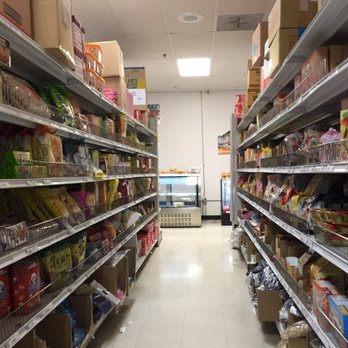
You are a GUI agent. You are given a task and a screenshot of the screen. Output one action in this format:
    pyautogui.click(x=<x>, y=<y>)
    Task: Click on the gray wall
    Image resolution: width=348 pixels, height=348 pixels.
    Given the screenshot: What is the action you would take?
    pyautogui.click(x=189, y=147)